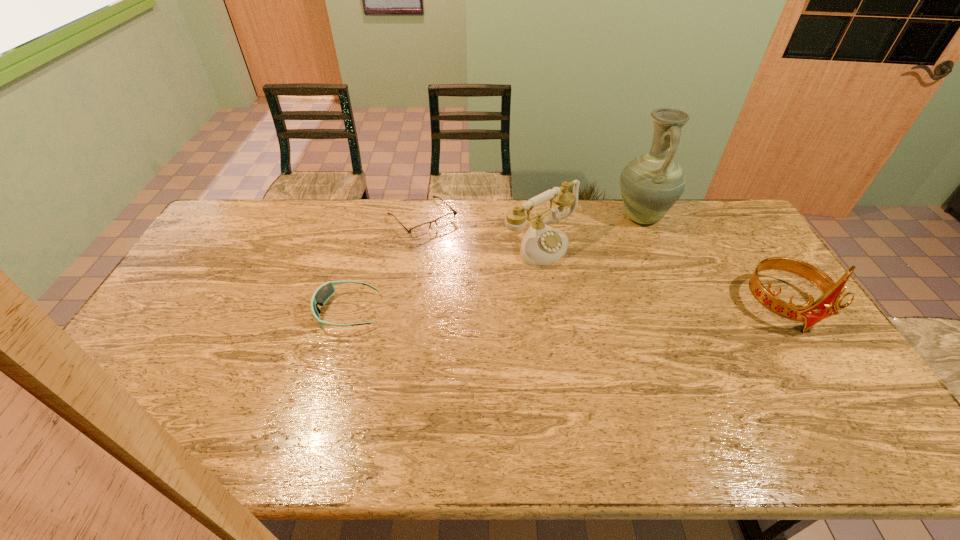
Where is `vacant area situated on the handle side of the tallest object`? The image size is (960, 540). vacant area situated on the handle side of the tallest object is located at coordinates (625, 259).

This screenshot has height=540, width=960. I want to click on telephone that is at the far edge, so click(541, 245).

Where is `spectacles situated at the far edge`? The image size is (960, 540). spectacles situated at the far edge is located at coordinates (446, 219).

This screenshot has width=960, height=540. What are the coordinates of `pitcher present at the far edge` in the screenshot? It's located at (650, 185).

Identify the location of object situated at the right edge. (810, 313).

Locate an element on the screen. The height and width of the screenshot is (540, 960). free space at the far edge of the desktop is located at coordinates (509, 232).

This screenshot has height=540, width=960. In the image, there is a desktop. In order to click on vacant space at the near edge in this screenshot , I will do `click(336, 407)`.

This screenshot has width=960, height=540. In order to click on free space at the left edge of the desktop in this screenshot , I will do `click(156, 350)`.

Locate an element on the screen. The image size is (960, 540). vacant space at the right edge of the desktop is located at coordinates (828, 364).

You are a GUI agent. You are given a task and a screenshot of the screen. Output one action in this format:
    pyautogui.click(x=<x>, y=<y>)
    Task: Click on the free spot at the far right corner of the desktop
    
    Given the screenshot: What is the action you would take?
    point(708,237)